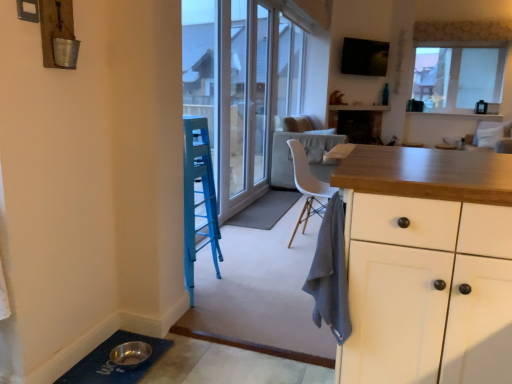
Question: Is white glossy screen door at center positioned in front of transparent glass window at upper right?

Choices:
 (A) yes
 (B) no

Answer: (A)

Question: Does white glossy screen door at center turn towards transparent glass window at upper right?

Choices:
 (A) no
 (B) yes

Answer: (A)

Question: Is transparent glass window at upper right surrounded by white glossy screen door at center?

Choices:
 (A) yes
 (B) no

Answer: (B)

Question: Is white glossy screen door at center facing away from transparent glass window at upper right?

Choices:
 (A) no
 (B) yes

Answer: (A)

Question: Is white glossy screen door at center shorter than transparent glass window at upper right?

Choices:
 (A) no
 (B) yes

Answer: (A)

Question: Considering the positions of transparent glass window at upper right and blue rubber doormat at lower left, positioned as the first doormat in bottom-to-top order, in the image, is transparent glass window at upper right wider or thinner than blue rubber doormat at lower left, positioned as the first doormat in bottom-to-top order,?

Choices:
 (A) wide
 (B) thin

Answer: (B)

Question: Is transparent glass window at upper right taller or shorter than blue rubber doormat at lower left, the second doormat viewed from the right?

Choices:
 (A) short
 (B) tall

Answer: (B)

Question: From a real-world perspective, is transparent glass window at upper right physically located above or below blue rubber doormat at lower left, marked as the 2th doormat in a top-to-bottom arrangement?

Choices:
 (A) above
 (B) below

Answer: (A)

Question: Visually, is transparent glass window at upper right positioned to the left or to the right of blue rubber doormat at lower left, the second doormat viewed from the right?

Choices:
 (A) left
 (B) right

Answer: (B)

Question: Considering the positions of point (243, 221) and point (223, 26), is point (243, 221) closer or farther from the camera than point (223, 26)?

Choices:
 (A) closer
 (B) farther

Answer: (B)

Question: Considering the positions of gray fabric doormat at center, marked as the 1th doormat in a top-to-bottom arrangement, and white glossy screen door at center in the image, is gray fabric doormat at center, marked as the 1th doormat in a top-to-bottom arrangement, wider or thinner than white glossy screen door at center?

Choices:
 (A) thin
 (B) wide

Answer: (B)

Question: From the image's perspective, relative to white glossy screen door at center, is gray fabric doormat at center, arranged as the second doormat when ordered from the bottom, above or below?

Choices:
 (A) above
 (B) below

Answer: (B)

Question: Is gray fabric doormat at center, arranged as the 2th doormat when viewed from the left, taller or shorter than white glossy screen door at center?

Choices:
 (A) short
 (B) tall

Answer: (A)

Question: Considering the positions of point (480, 125) and point (251, 170), is point (480, 125) closer or farther from the camera than point (251, 170)?

Choices:
 (A) farther
 (B) closer

Answer: (A)

Question: In the image, is white fabric armchair at upper right on the left side or the right side of white glossy screen door at center?

Choices:
 (A) right
 (B) left

Answer: (A)